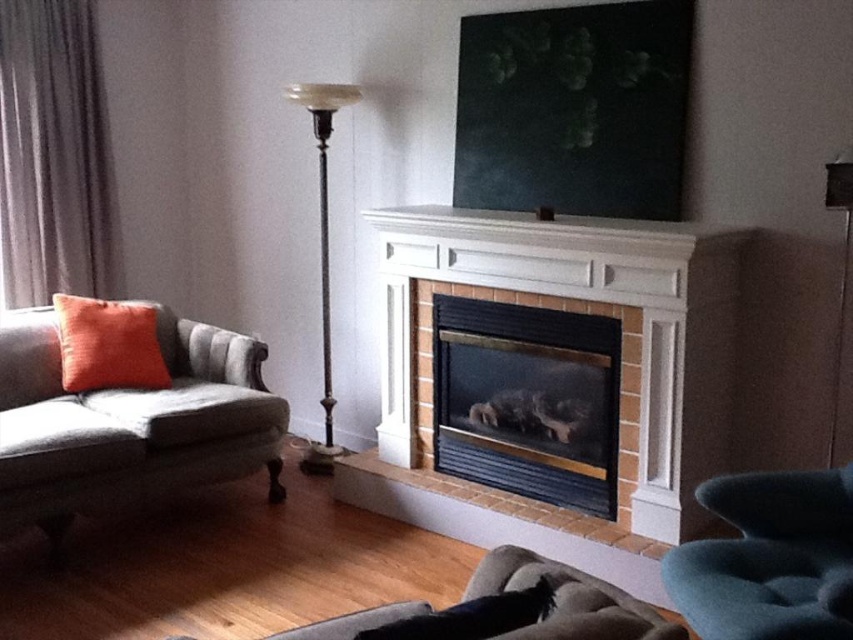
Is point (683, 573) positioned behind point (408, 630)?

That is True.

Locate an element on the screen. Image resolution: width=853 pixels, height=640 pixels. velvet teal armchair at lower right is located at coordinates (769, 557).

Can you confirm if velvet orange pillow at left is thinner than dark gray fabric curtain at left?

Incorrect, velvet orange pillow at left's width is not less than dark gray fabric curtain at left's.

Which is in front, point (86, 499) or point (16, 166)?

Point (86, 499)

Find the location of `velvet orange pillow at left`. velvet orange pillow at left is located at coordinates (128, 422).

Can you confirm if velvet orange pillow at left is bigger than metallic pole at center?

Correct, velvet orange pillow at left is larger in size than metallic pole at center.

This screenshot has width=853, height=640. Describe the element at coordinates (128, 422) in the screenshot. I see `velvet orange pillow at left` at that location.

The image size is (853, 640). Find the location of `velvet orange pillow at left`. velvet orange pillow at left is located at coordinates (128, 422).